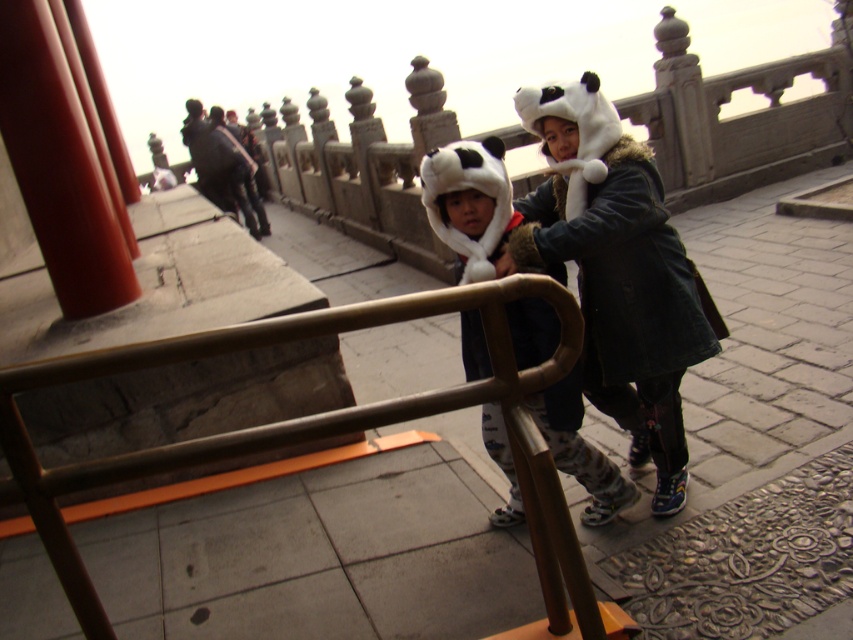
You are a photographer positioned at the camera location. You want to take a photo that includes both the point at coordinates point (68, 566) and point (561, 243). However, you notice that one of the points might be obscured by an object in the scene. Based on their positions relative to the camera, which point is more likely to be visible in the photo?

Point (68, 566) is closer to the camera than point (561, 243), so it is more likely to be visible in the photo.

You are a tour guide explaining the layout of the site to visitors. You point out the metallic rail at center and the white fur hat at center. Which object is positioned to the left from the visitors perspective?

The metallic rail at center is to the left of the white fur hat at center, so the metallic rail at center is positioned to the left from the visitors perspective.

You are a photographer setting up a camera to take a group photo of the two children wearing white fur hat at center and white plush panda hat at center. The camera has a focus range of 10 inches. Will both hats be in focus if you focus on the center of the scene?

The white fur hat at center and white plush panda hat at center are 9.72 inches apart. Since the camera can focus within a range of 10 inches, both hats will be in focus when centered.